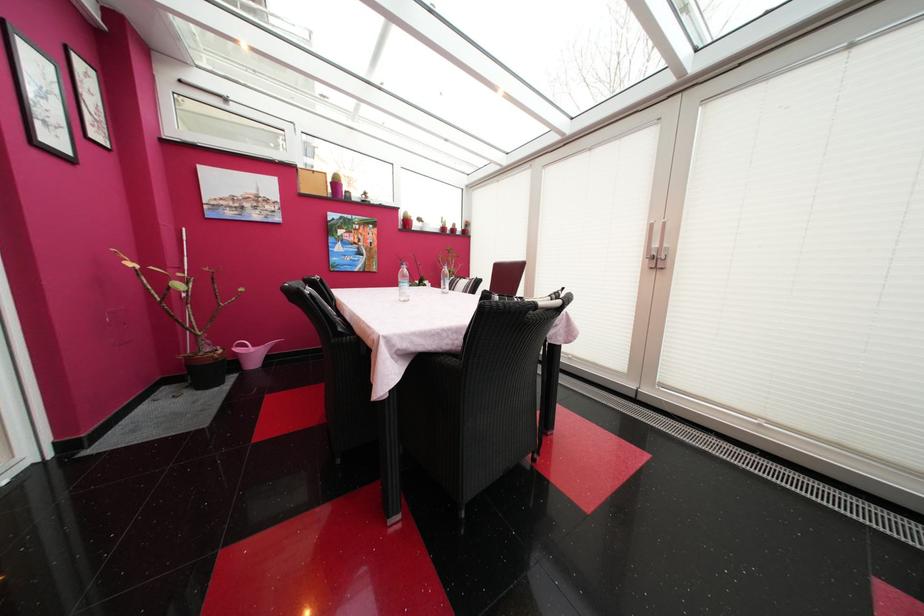
Where would you lift the plastic water bottle? Please return your answer as a coordinate pair (x, y).

(403, 283)